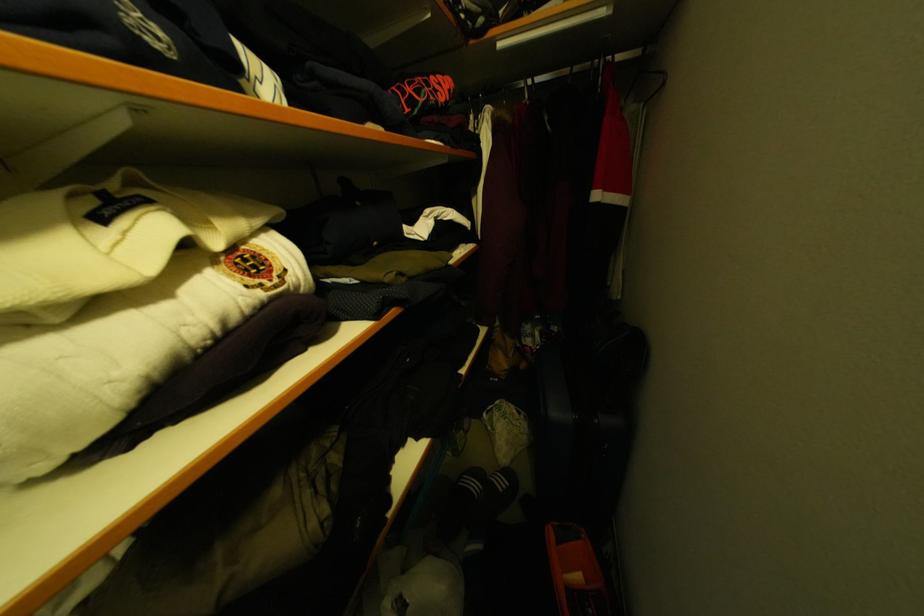
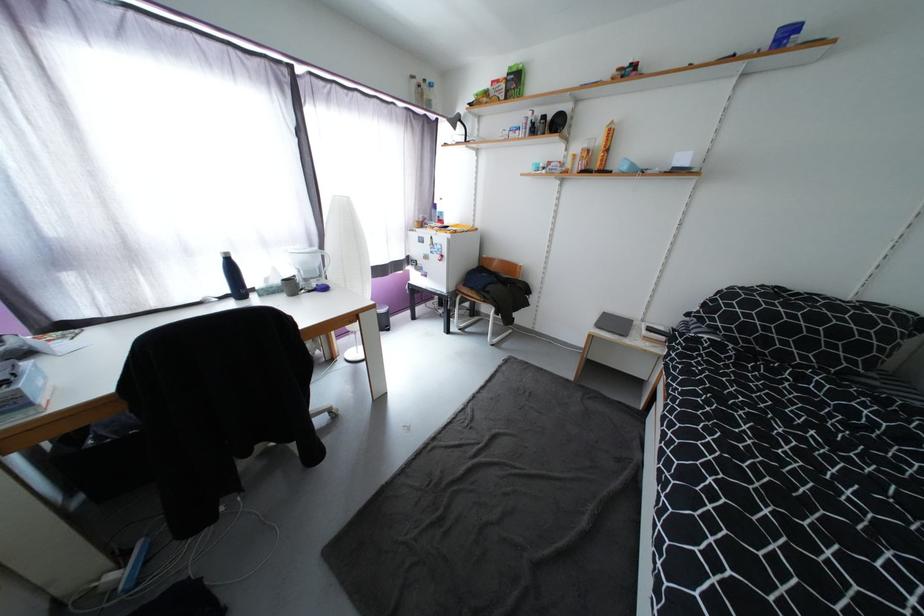
Question: Which direction would the cameraman need to move to produce the second image? Reply with the corresponding letter.

Choices:
 (A) Left
 (B) Right
 (C) Forward
 (D) Backward

Answer: (A)